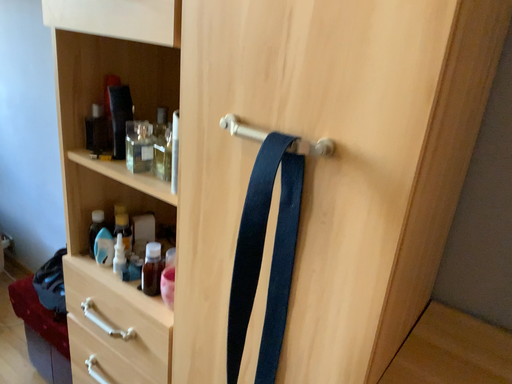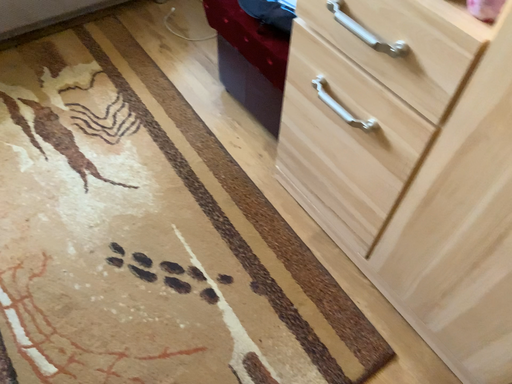
Question: How did the camera likely rotate when shooting the video?

Choices:
 (A) rotated right
 (B) rotated left

Answer: (B)